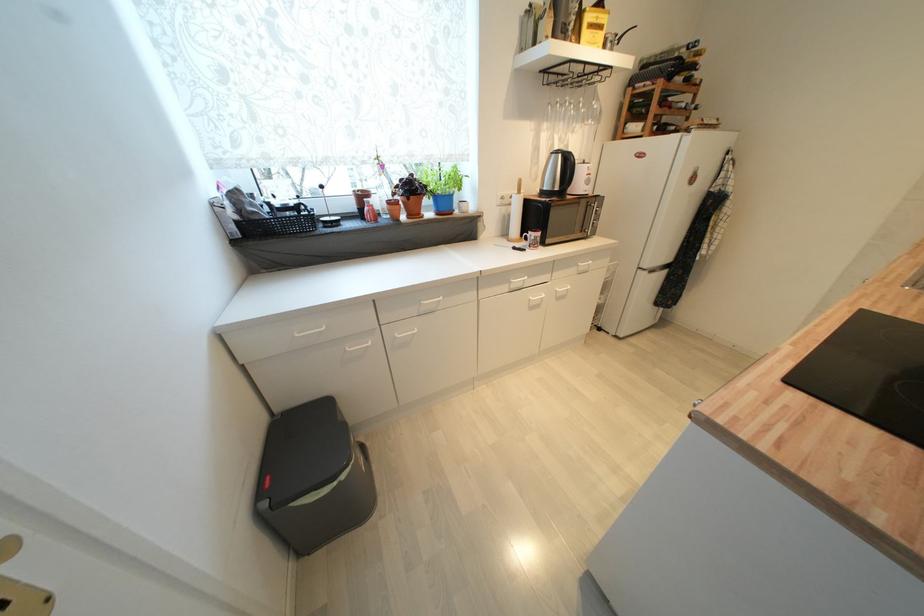
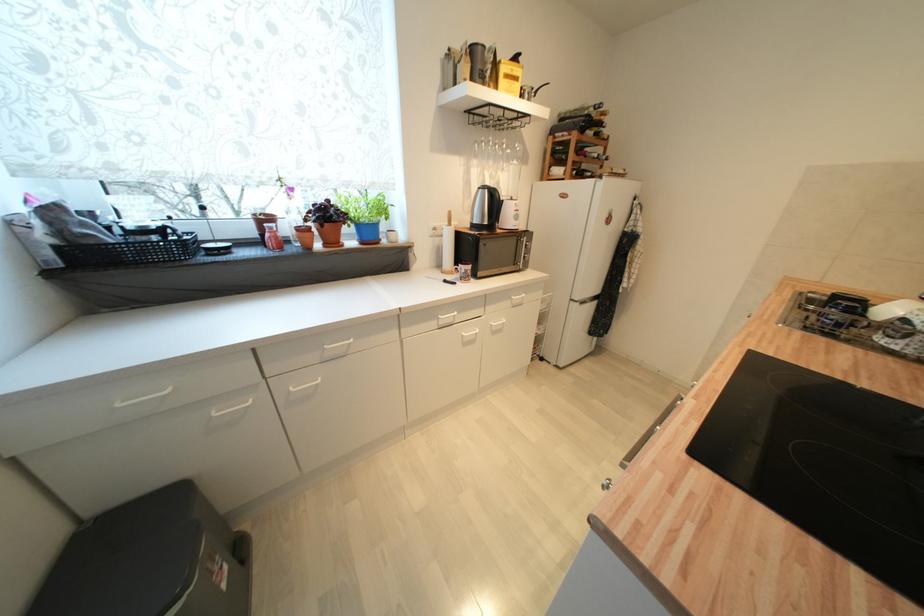
Where in the second image is the point corresponding to [516,284] from the first image?

(444, 321)